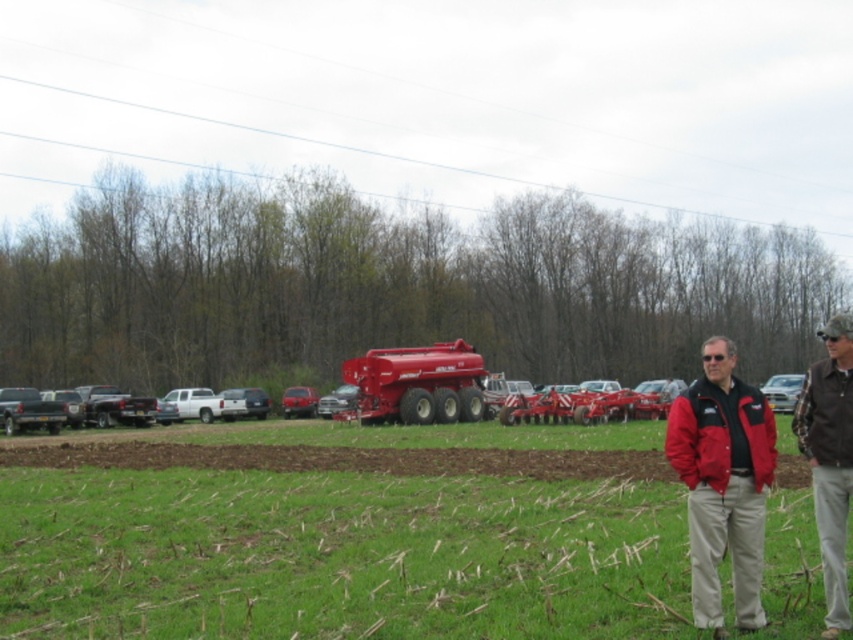
Question: Which of these objects is positioned farthest from the metallic silver car at center?

Choices:
 (A) white glossy car at right
 (B) brown/cotton shirt at lower right
 (C) matte black truck at center

Answer: (B)

Question: Which object is closer to the camera taking this photo?

Choices:
 (A) brown/cotton shirt at lower right
 (B) matte black truck at center

Answer: (A)

Question: Is green grass at center further to camera compared to metallic red car at center?

Choices:
 (A) yes
 (B) no

Answer: (B)

Question: Does matte red trailer truck at center appear under white glossy car at right?

Choices:
 (A) yes
 (B) no

Answer: (B)

Question: Observing the image, what is the correct spatial positioning of matte black truck at center in reference to metallic red car at center?

Choices:
 (A) left
 (B) right

Answer: (A)

Question: Based on their relative distances, which object is nearer to the matte black truck at center?

Choices:
 (A) red softshell jacket at lower right
 (B) white glossy car at right

Answer: (B)